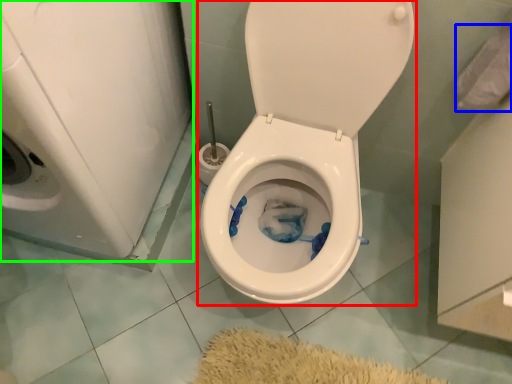
Question: Estimate the real-world distances between objects in this image. Which object is closer to toilet (highlighted by a red box), toilet paper (highlighted by a blue box) or washer (highlighted by a green box)?

Choices:
 (A) toilet paper
 (B) washer

Answer: (B)